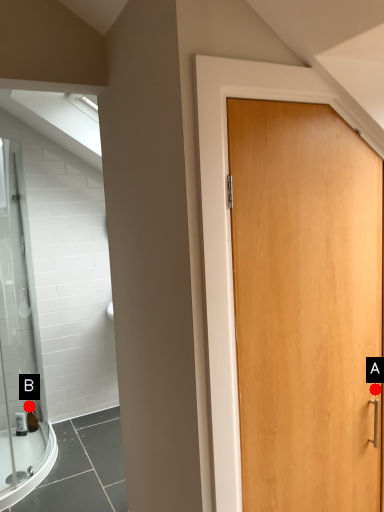
Question: Two points are circled on the image, labeled by A and B beside each circle. Among these points, which one is nearest to the camera?

Choices:
 (A) A is closer
 (B) B is closer

Answer: (A)